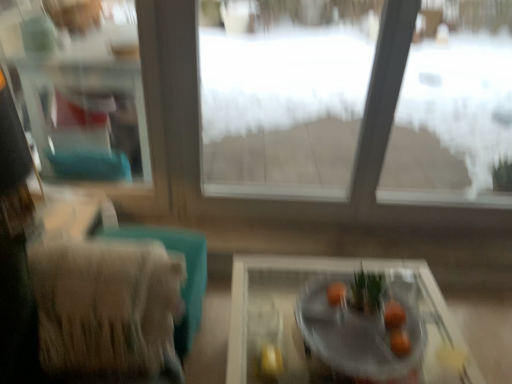
In order to face clear glass window frame at upper left, should I rotate leftwards or rightwards?

You should rotate left by 21.185 degrees.

Describe the element at coordinates (340, 325) in the screenshot. The width and height of the screenshot is (512, 384). I see `clear glass tray at center` at that location.

This screenshot has width=512, height=384. What are the coordinates of `transparent glass window at center` in the screenshot? It's located at (200, 143).

Where is `beige fabric armchair at left`? The height and width of the screenshot is (384, 512). beige fabric armchair at left is located at coordinates (105, 305).

What's the angular difference between beige fabric armchair at left and clear glass tray at center's facing directions?

86.5 degrees separate the facing orientations of beige fabric armchair at left and clear glass tray at center.

Considering the points (115, 252) and (444, 346), which point is in front, point (115, 252) or point (444, 346)?

The point (115, 252) is closer to the camera.

How much distance is there between beige fabric armchair at left and clear glass tray at center?

beige fabric armchair at left is 20.94 inches from clear glass tray at center.

Considering the sizes of beige fabric armchair at left and clear glass tray at center in the image, is beige fabric armchair at left wider or thinner than clear glass tray at center?

Clearly, beige fabric armchair at left has less width compared to clear glass tray at center.

Are beige fabric armchair at left and clear glass bowl at center making contact?

No, beige fabric armchair at left is not next to clear glass bowl at center.

Which object is wider, beige fabric armchair at left or clear glass bowl at center?

Wider between the two is beige fabric armchair at left.

Does beige fabric armchair at left have a larger size compared to clear glass bowl at center?

Yes.

Is point (57, 246) positioned behind point (421, 335)?

That is False.

From a real-world perspective, which object rests below the other?

In real-world perspective, clear glass tray at center is lower.

From the image's perspective, is smooth orange fruit at center located beneath clear glass tray at center?

Actually, smooth orange fruit at center appears above clear glass tray at center in the image.

Are smooth orange fruit at center and clear glass tray at center beside each other?

No, smooth orange fruit at center is not next to clear glass tray at center.

Based on the photo, considering the relative sizes of orange matte at center and beige fabric armchair at left in the image provided, is orange matte at center taller than beige fabric armchair at left?

No, orange matte at center is not taller than beige fabric armchair at left.

From the image's perspective, which one is positioned lower, orange matte at center or beige fabric armchair at left?

From the image's view, beige fabric armchair at left is below.

This screenshot has width=512, height=384. Find the location of `armchair on the left of orange matte at center`. armchair on the left of orange matte at center is located at coordinates point(105,305).

Can you confirm if orange matte at center is wider than beige fabric armchair at left?

No, orange matte at center is not wider than beige fabric armchair at left.

Considering the sizes of objects transparent glass window at center and clear glass tray at center in the image provided, who is wider, transparent glass window at center or clear glass tray at center?

clear glass tray at center.

Considering the sizes of objects transparent glass window at center and clear glass tray at center in the image provided, who is smaller, transparent glass window at center or clear glass tray at center?

clear glass tray at center.

You are a GUI agent. You are given a task and a screenshot of the screen. Output one action in this format:
    pyautogui.click(x=<x>, y=<y>)
    Task: Click on the table directly beneath the transparent glass window at center (from a real-world perspective)
    
    Given the screenshot: What is the action you would take?
    pyautogui.click(x=340, y=325)

Which object is positioned more to the left, transparent glass window at center or clear glass tray at center?

Positioned to the left is transparent glass window at center.

Does clear glass bowl at center turn towards smooth orange fruit at center?

No, clear glass bowl at center does not turn towards smooth orange fruit at center.

Is clear glass bowl at center bigger than smooth orange fruit at center?

Correct, clear glass bowl at center is larger in size than smooth orange fruit at center.

Considering the points (272, 261) and (389, 369), which point is in front, point (272, 261) or point (389, 369)?

The point (389, 369) is in front.

Is clear glass tray at center positioned beyond the bounds of clear glass bowl at center?

clear glass tray at center lies outside clear glass bowl at center's area.

Is clear glass tray at center bigger than clear glass bowl at center?

Yes.

Considering the relative sizes of clear glass tray at center and clear glass bowl at center in the image provided, is clear glass tray at center thinner than clear glass bowl at center?

In fact, clear glass tray at center might be wider than clear glass bowl at center.

Locate an element on the screen. table below the beige fabric armchair at left (from the image's perspective) is located at coordinates (340, 325).

Where is `armchair to the left of clear glass bowl at center`? Image resolution: width=512 pixels, height=384 pixels. armchair to the left of clear glass bowl at center is located at coordinates (105, 305).

Which object lies nearer to the anchor point smooth orange fruit at center, beige fabric armchair at left or transparent glass window at center?

beige fabric armchair at left.

Considering their positions, is orange matte at center positioned further to smooth orange fruit at center than clear glass bowl at center?

orange matte at center is positioned further to the anchor smooth orange fruit at center.

Based on their spatial positions, is clear glass bowl at center or beige fabric armchair at left closer to orange matte at center?

clear glass bowl at center is closer to orange matte at center.

Considering their positions, is smooth orange fruit at center positioned closer to transparent glass window at center than beige fabric armchair at left?

smooth orange fruit at center lies closer to transparent glass window at center than the other object.

Looking at the image, which one is located closer to smooth orange fruit at center, clear glass bowl at center or orange matte at center?

clear glass bowl at center lies closer to smooth orange fruit at center than the other object.

Considering their positions, is smooth orange fruit at center positioned closer to clear glass tray at center than clear glass window frame at upper left?

smooth orange fruit at center is closer to clear glass tray at center.

Looking at the image, which one is located closer to transparent glass window at center, clear glass bowl at center or orange matte at center?

Based on the image, clear glass bowl at center appears to be nearer to transparent glass window at center.

Based on their spatial positions, is beige fabric armchair at left or smooth orange fruit at center further from orange matte at center?

beige fabric armchair at left is further to orange matte at center.

Find the location of a particular element. table located between beige fabric armchair at left and orange matte at center in the left-right direction is located at coordinates (340, 325).

You are a GUI agent. You are given a task and a screenshot of the screen. Output one action in this format:
    pyautogui.click(x=<x>, y=<y>)
    Task: Click on the food between transparent glass window at center and orange matte at center in the vertical direction
    
    Given the screenshot: What is the action you would take?
    (373, 306)

I want to click on food between transparent glass window at center and clear glass bowl at center vertically, so click(x=373, y=306).

Where is `fruit between transparent glass window at center and clear glass bowl at center from top to bottom`? The height and width of the screenshot is (384, 512). fruit between transparent glass window at center and clear glass bowl at center from top to bottom is located at coordinates tap(394, 315).